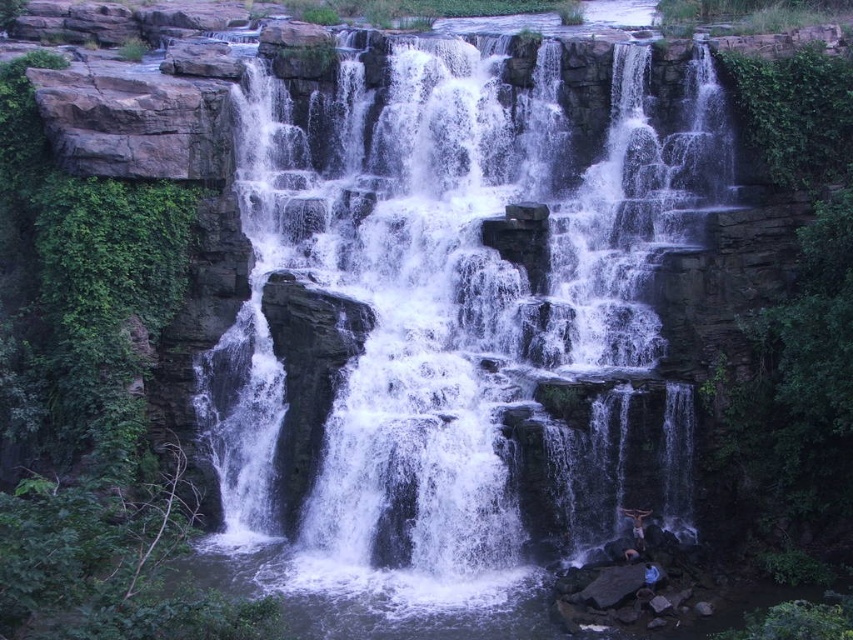
You are standing at the top of the waterfall and want to get to the blue fabric person at lower right. Which direction should you go relative to the dark skin person at lower right?

You should go to the right of the dark skin person at lower right because the dark skin person at lower right is to the left of the blue fabric person at lower right, so moving right from the dark skin person at lower right will lead you towards the blue fabric person at lower right.

You are a photographer standing at the bottom of the waterfall. You want to capture a photo that includes both the white frothy water at center and the dark skin person at lower right. Which object will appear larger in the photo?

The white frothy water at center will appear larger in the photo because it is bigger than the dark skin person at lower right.